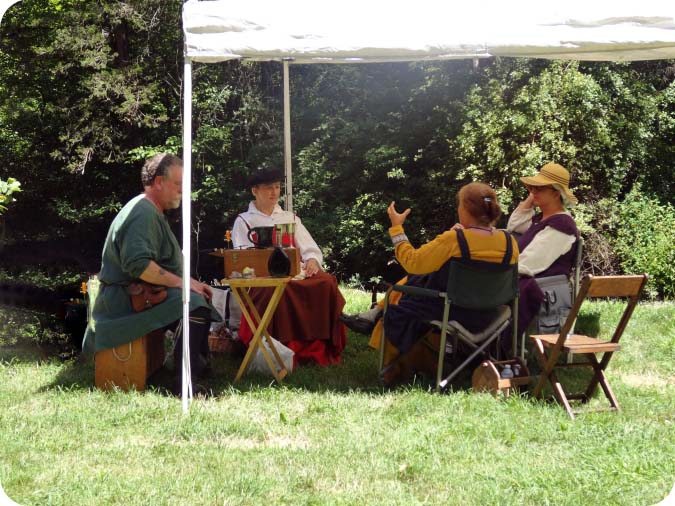
Where is `chair`? chair is located at coordinates (497, 292).